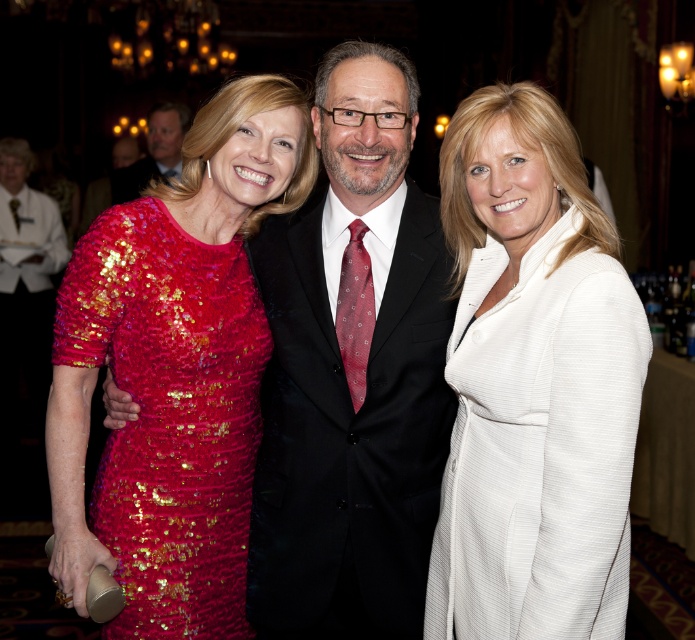
Question: Which point appears farthest from the camera in this image?

Choices:
 (A) (10, 205)
 (B) (452, 605)

Answer: (A)

Question: Considering the real-world distances, which object is closest to the matte red tie at center?

Choices:
 (A) sequined red dress at left
 (B) shiny black suit at center
 (C) shiny burgundy tie at center
 (D) matte black suit at center

Answer: (D)

Question: Observing the image, what is the correct spatial positioning of white textured coat at center in reference to matte black suit at center?

Choices:
 (A) above
 (B) below

Answer: (B)

Question: Does shiny black suit at center have a smaller size compared to sequined red dress at left?

Choices:
 (A) yes
 (B) no

Answer: (B)

Question: Based on their relative distances, which object is farther from the shiny black suit at center?

Choices:
 (A) matte red tie at center
 (B) white textured coat at center

Answer: (A)

Question: Considering the relative positions of shiny black suit at center and matte red tie at center in the image provided, where is shiny black suit at center located with respect to matte red tie at center?

Choices:
 (A) above
 (B) below

Answer: (B)